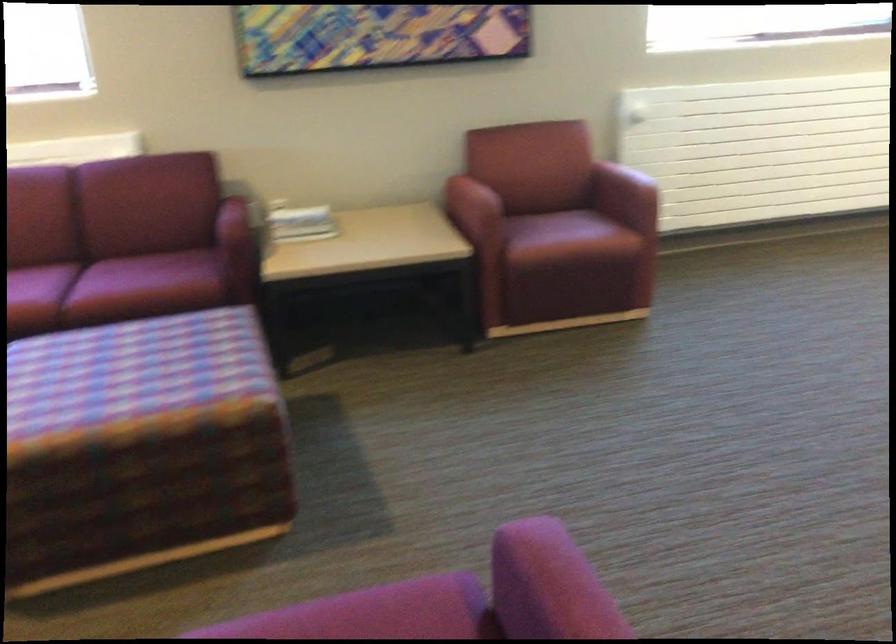
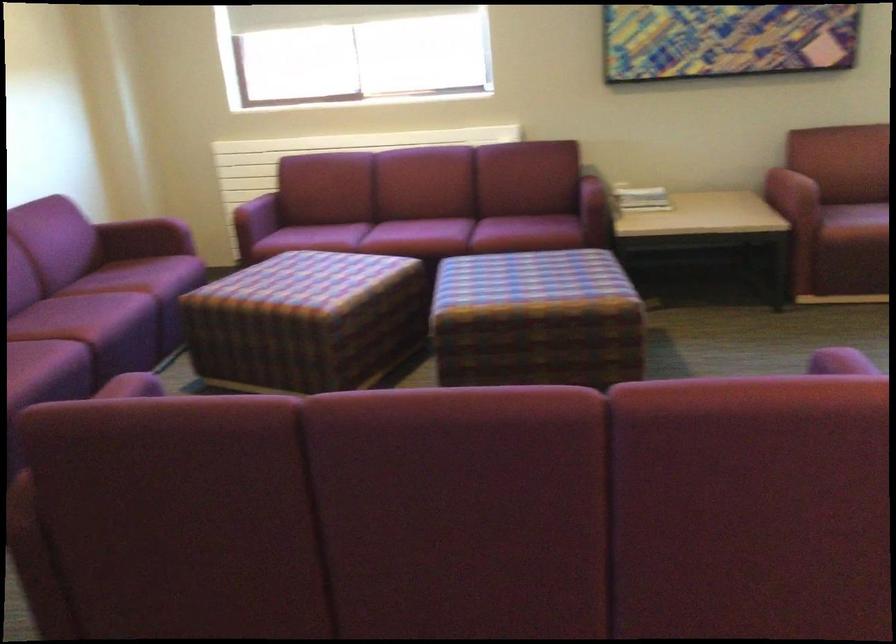
Find the pixel in the second image that matches pixel 295 231 in the first image.

(640, 198)